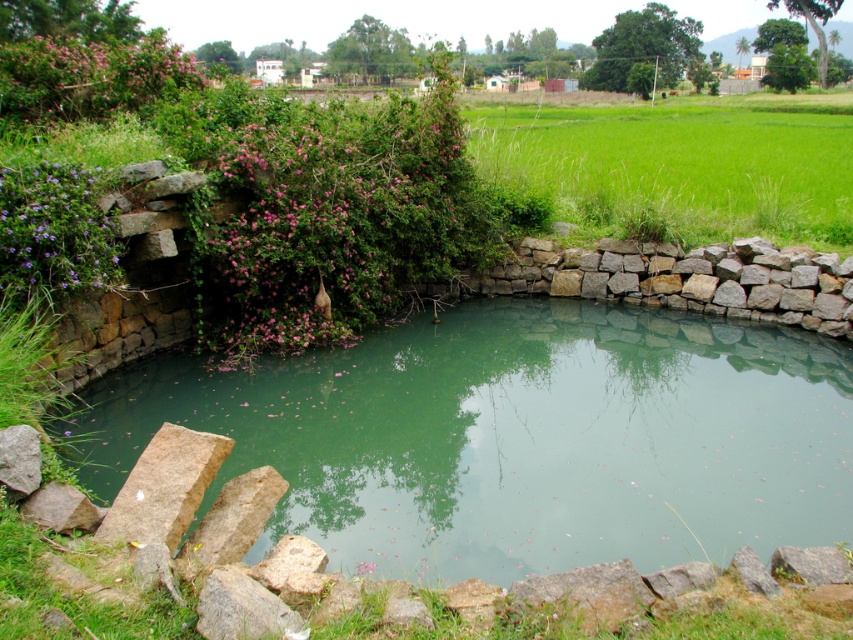
Question: Does green grassy field at upper right come in front of natural stone wall at right?

Choices:
 (A) no
 (B) yes

Answer: (A)

Question: Which point appears farthest from the camera in this image?

Choices:
 (A) (599, 132)
 (B) (676, 467)

Answer: (A)

Question: Can you confirm if green stone water at center is positioned above gray rough rock at lower left?

Choices:
 (A) yes
 (B) no

Answer: (A)

Question: Considering the relative positions of green stone water at center and green grassy field at upper right in the image provided, where is green stone water at center located with respect to green grassy field at upper right?

Choices:
 (A) right
 (B) left

Answer: (B)

Question: Based on their relative distances, which object is farther from the green stone water at center?

Choices:
 (A) gray rough rock at lower left
 (B) natural stone wall at right
 (C) green grassy field at upper right

Answer: (C)

Question: Among these objects, which one is nearest to the camera?

Choices:
 (A) green grassy field at upper right
 (B) natural stone wall at right
 (C) green stone water at center
 (D) gray rough rock at lower left

Answer: (D)